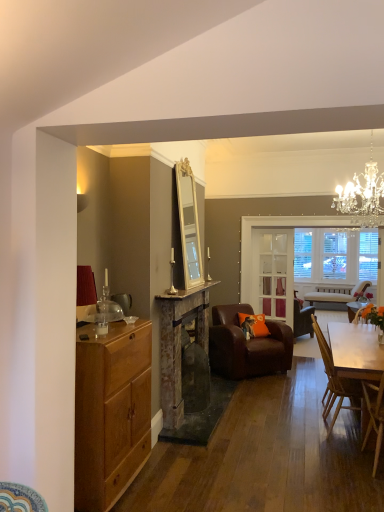
Question: From the image's perspective, is clear glass door at center on brown leather armchair at center, which is counted as the first chair, starting from the back?

Choices:
 (A) yes
 (B) no

Answer: (A)

Question: Is the depth of clear glass door at center greater than that of brown leather armchair at center, the 3th chair viewed from the front?

Choices:
 (A) no
 (B) yes

Answer: (B)

Question: Does clear glass door at center contain brown leather armchair at center, which is counted as the first chair, starting from the back?

Choices:
 (A) no
 (B) yes

Answer: (A)

Question: From a real-world perspective, is clear glass door at center positioned over brown leather armchair at center, the 3th chair viewed from the front, based on gravity?

Choices:
 (A) yes
 (B) no

Answer: (A)

Question: Considering the relative sizes of clear glass door at center and brown leather armchair at center, the 3th chair viewed from the front, in the image provided, is clear glass door at center shorter than brown leather armchair at center, the 3th chair viewed from the front,?

Choices:
 (A) yes
 (B) no

Answer: (B)

Question: Does clear glass door at center have a greater height compared to brown leather armchair at center, the 3th chair viewed from the front?

Choices:
 (A) no
 (B) yes

Answer: (B)

Question: Is light brown wood cabinet at left surrounding crystal chandelier at upper right?

Choices:
 (A) yes
 (B) no

Answer: (B)

Question: Does light brown wood cabinet at left come in front of crystal chandelier at upper right?

Choices:
 (A) no
 (B) yes

Answer: (B)

Question: Does light brown wood cabinet at left have a greater width compared to crystal chandelier at upper right?

Choices:
 (A) yes
 (B) no

Answer: (B)

Question: Does light brown wood cabinet at left touch crystal chandelier at upper right?

Choices:
 (A) yes
 (B) no

Answer: (B)

Question: Considering the relative sizes of light brown wood cabinet at left and crystal chandelier at upper right in the image provided, is light brown wood cabinet at left shorter than crystal chandelier at upper right?

Choices:
 (A) yes
 (B) no

Answer: (B)

Question: Is light brown wood cabinet at left positioned behind crystal chandelier at upper right?

Choices:
 (A) yes
 (B) no

Answer: (B)

Question: Does wooden chair at lower right, which is the 3th chair from back to front, come in front of clear glass door at center?

Choices:
 (A) yes
 (B) no

Answer: (A)